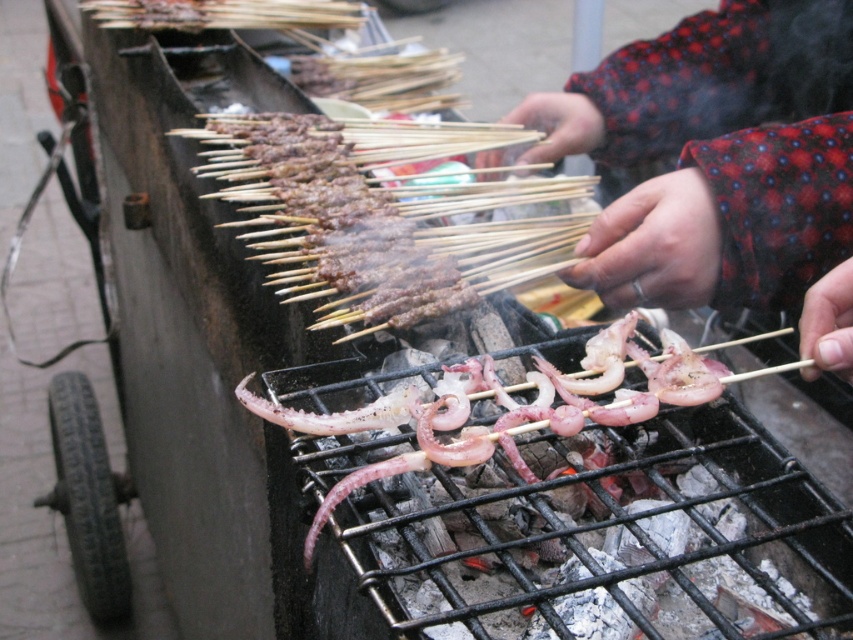
You are a customer at the street food stall and want to grab the pink translucent squid at center. However, there is a red dotted sweater at center in the way. Can you reach the squid without moving the sweater?

The red dotted sweater at center is closer to you than the pink translucent squid at center, so you cannot reach the squid without moving the sweater.

You are a customer looking at the street food stall. You notice the red dotted sweater at center and the brown charred skewers at center. Which object is closer to you?

The red dotted sweater at center is closer to you because it is in front of the brown charred skewers at center.

You are a customer at the street food stall and want to choose between the red dotted sweater at center and the pink translucent squid at center. Which one is wider?

The pink translucent squid at center is wider than the red dotted sweater at center.